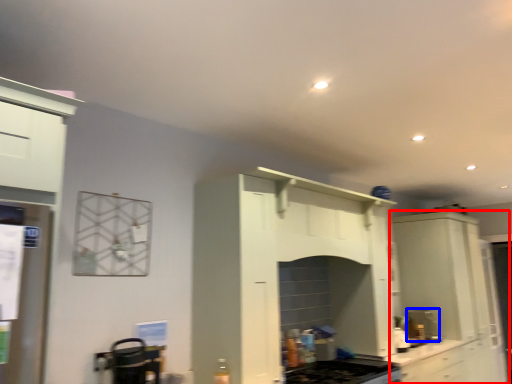
Question: Which object is further to the camera taking this photo, cabinetry (highlighted by a red box) or coffee machine (highlighted by a blue box)?

Choices:
 (A) cabinetry
 (B) coffee machine

Answer: (B)